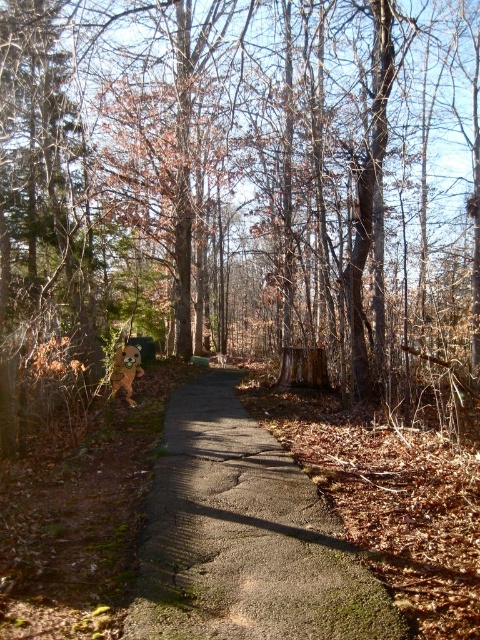
Question: Estimate the real-world distances between objects in this image. Which object is farther from the brown furry dog at center?

Choices:
 (A) brown wood tree at center
 (B) concrete path at center
 (C) brown rough wood at center

Answer: (A)

Question: Among these objects, which one is farthest from the camera?

Choices:
 (A) concrete path at center
 (B) brown rough wood at center

Answer: (B)

Question: Which point appears closest to the camera in this image?

Choices:
 (A) (222, 212)
 (B) (213, 372)

Answer: (B)

Question: Is concrete path at center closer to camera compared to brown rough wood at center?

Choices:
 (A) no
 (B) yes

Answer: (B)

Question: Can you confirm if concrete path at center is positioned below brown rough wood at center?

Choices:
 (A) yes
 (B) no

Answer: (A)

Question: Can you confirm if brown rough wood at center is bigger than brown furry dog at center?

Choices:
 (A) yes
 (B) no

Answer: (B)